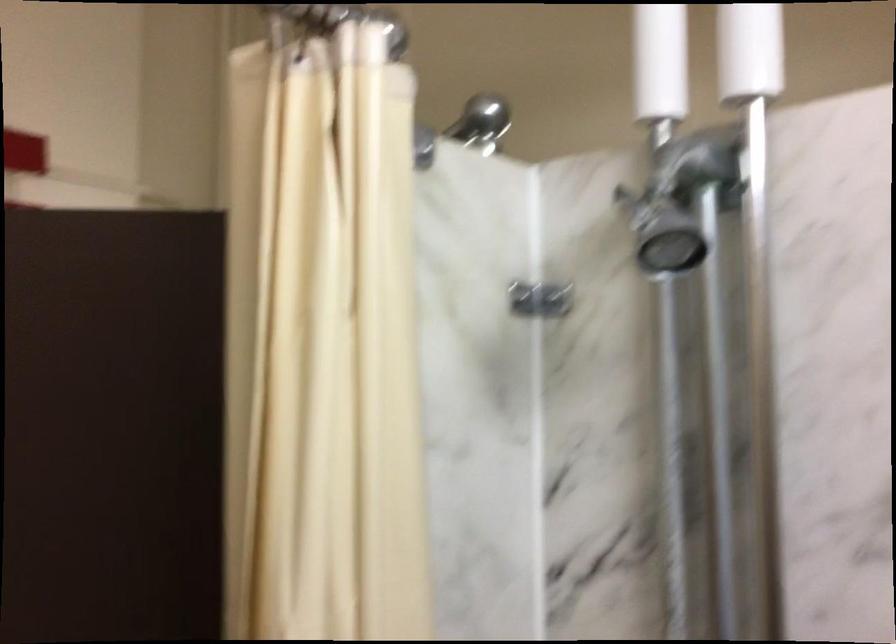
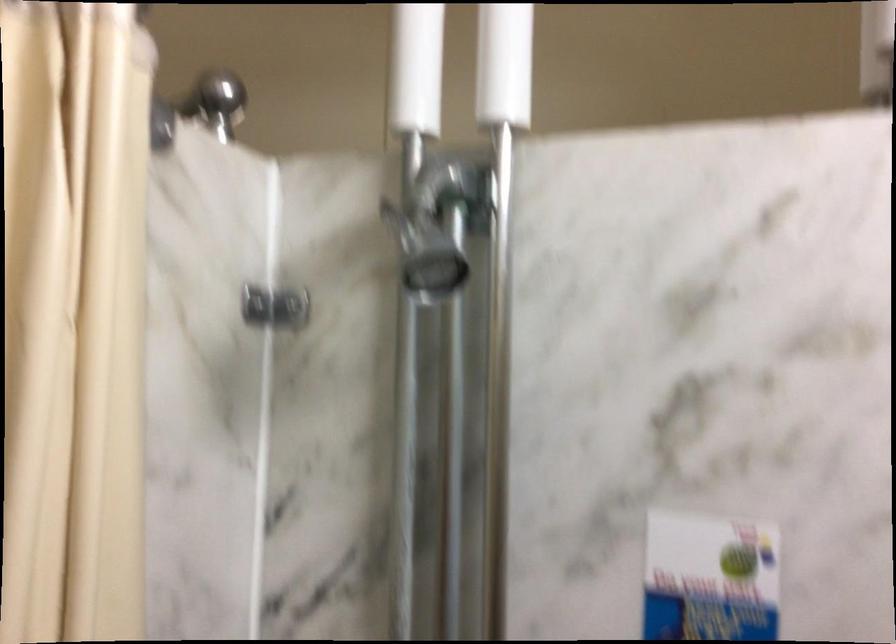
First-person continuous shooting, in which direction is the camera rotating?

The camera rotated toward right-down.